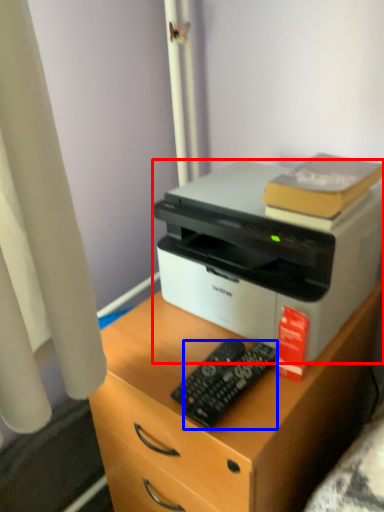
Question: Among these objects, which one is farthest to the camera, printer (highlighted by a red box) or control (highlighted by a blue box)?

Choices:
 (A) printer
 (B) control

Answer: (B)